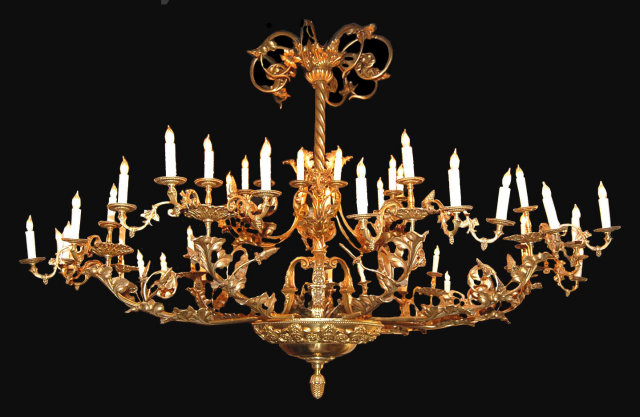
Where is `finial`? Image resolution: width=640 pixels, height=417 pixels. finial is located at coordinates (320, 388).